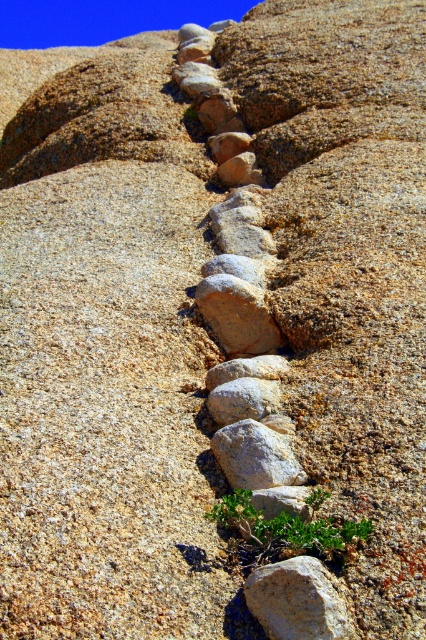
You are standing at the point marked by the coordinates point (285, 531). Looking around, you see a rugged rocky terrain with a path of stones running diagonally. Which direction should you walk to reach the green leafy plant at lower center?

The green leafy plant at lower center is located at point (285, 531), so you are already standing at that location.